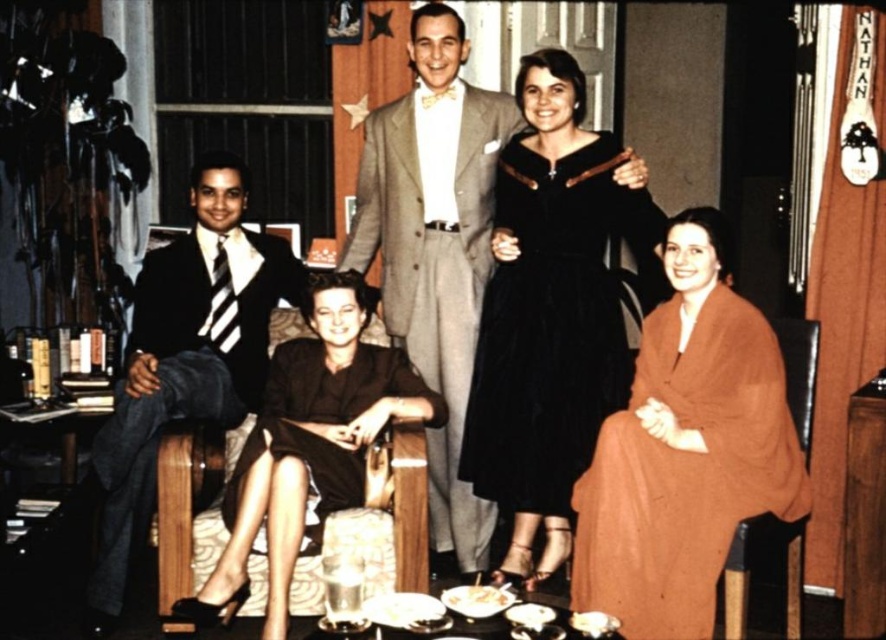
You are attending a formal event and see the brown woolen shawl at lower right and the brown satin dress at center. Which item is positioned higher in the image?

The brown woolen shawl at lower right is located above the brown satin dress at center, so it is positioned higher in the image.

You are a photographer arranging a group photo. You need to ensure that the light gray wool suit at center and the black wool suit at left are positioned so that their widths do not overlap. Based on the scene description, which suit should be placed farther back to avoid overlapping?

The light gray wool suit at center might be wider than black wool suit at left, so placing the wider light gray wool suit at center farther back would help prevent overlapping with the narrower black wool suit at left.

You are organizing a charity event and need to arrange the brown woolen shawl at lower right and the black wool suit at left on a display rack. According to the image, which item should be placed closer to the front of the rack?

The brown woolen shawl at lower right should be placed closer to the front of the rack because it is positioned in front of the black wool suit at left in the image.